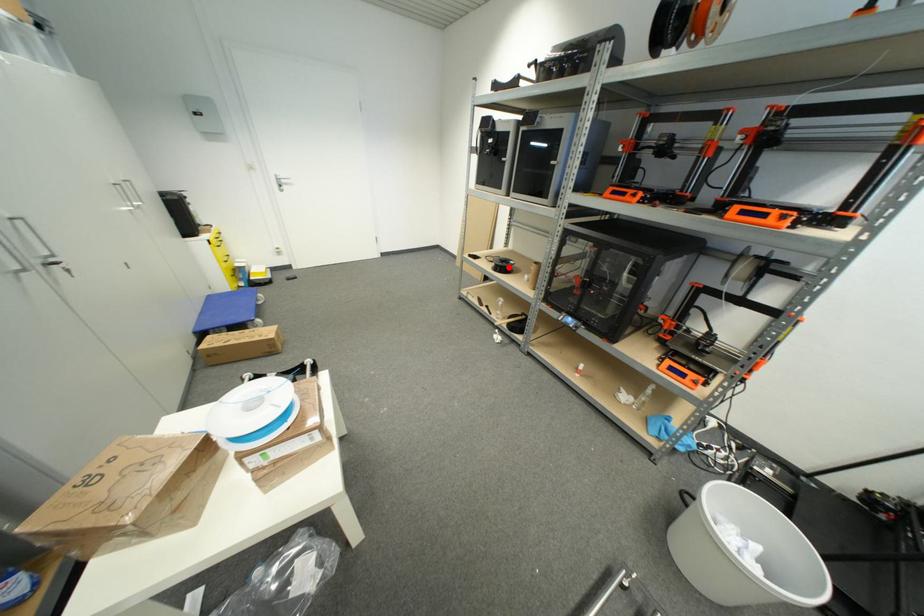
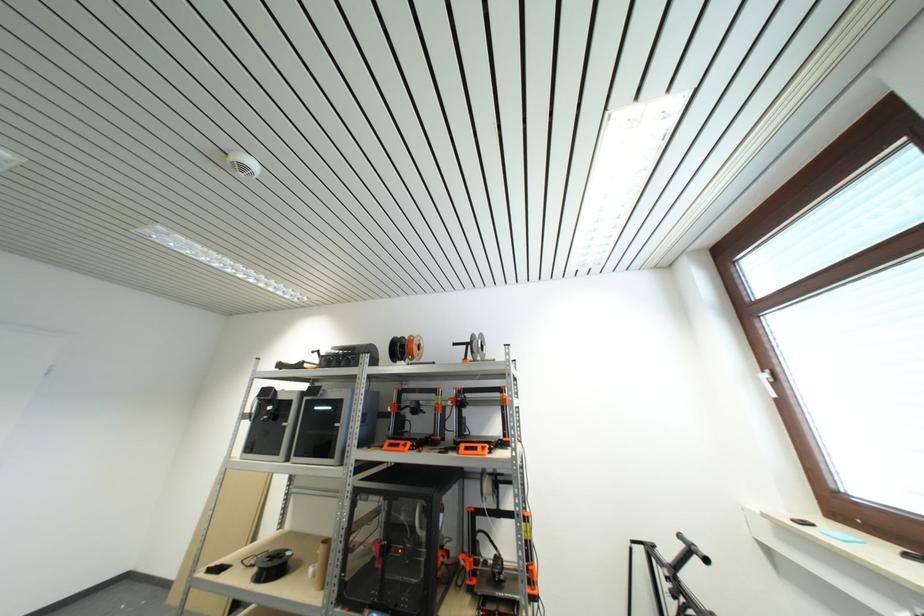
Locate, in the second image, the point that corresponds to the highlighted location in the first image.

(281, 565)